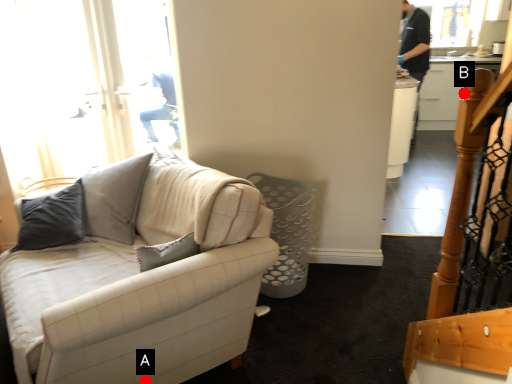
Question: Two points are circled on the image, labeled by A and B beside each circle. Which point is further to the camera?

Choices:
 (A) A is further
 (B) B is further

Answer: (B)